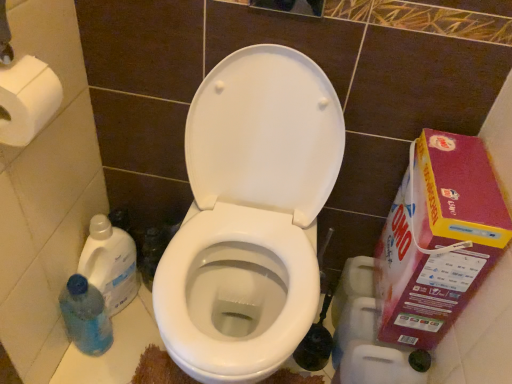
The image size is (512, 384). Find the location of `white matte toilet paper at upper left`. white matte toilet paper at upper left is located at coordinates (27, 100).

Where is `blue translucent bottle at lower left, which ranks as the second cleaning product in bottom-to-top order`? The image size is (512, 384). blue translucent bottle at lower left, which ranks as the second cleaning product in bottom-to-top order is located at coordinates (110, 263).

Who is shorter, blue translucent bottle at lower left, which ranks as the second cleaning product in bottom-to-top order, or white matte toilet paper at upper left?

white matte toilet paper at upper left is shorter.

From the image's perspective, would you say blue translucent bottle at lower left, which ranks as the second cleaning product in bottom-to-top order, is shown under white matte toilet paper at upper left?

Yes.

From a real-world perspective, which is physically below, blue translucent bottle at lower left, which ranks as the second cleaning product in bottom-to-top order, or white matte toilet paper at upper left?

blue translucent bottle at lower left, which ranks as the second cleaning product in bottom-to-top order, from a real-world perspective.

Looking at this image, which object is positioned more to the left, blue translucent bottle at lower left, positioned as the 1th cleaning product in top-to-bottom order, or white matte toilet paper at upper left?

blue translucent bottle at lower left, positioned as the 1th cleaning product in top-to-bottom order, is more to the left.

Does point (54, 73) lie in front of point (306, 147)?

Yes, it is.

Is white matte toilet paper at upper left next to white glossy toilet at center and touching it?

white matte toilet paper at upper left is not next to white glossy toilet at center, and they're not touching.

Consider the image. Is white matte toilet paper at upper left spatially inside white glossy toilet at center, or outside of it?

white matte toilet paper at upper left is outside white glossy toilet at center.

Considering the relative positions of white matte toilet paper at upper left and white glossy toilet at center in the image provided, is white matte toilet paper at upper left to the left or to the right of white glossy toilet at center?

white matte toilet paper at upper left is positioned on white glossy toilet at center's left side.

Based on the photo, considering the sizes of blue translucent bottle at lower left, which is the 1th cleaning product in bottom-to-top order, and white matte toilet paper at upper left in the image, is blue translucent bottle at lower left, which is the 1th cleaning product in bottom-to-top order, wider or thinner than white matte toilet paper at upper left?

Considering their sizes, blue translucent bottle at lower left, which is the 1th cleaning product in bottom-to-top order, looks slimmer than white matte toilet paper at upper left.

From a real-world perspective, is blue translucent bottle at lower left, which is the 1th cleaning product in bottom-to-top order, on top of white matte toilet paper at upper left?

No, from a real-world perspective, blue translucent bottle at lower left, which is the 1th cleaning product in bottom-to-top order, is not over white matte toilet paper at upper left

Locate an element on the screen. This screenshot has width=512, height=384. toilet paper above the blue translucent bottle at lower left, which ranks as the 2th cleaning product in top-to-bottom order (from a real-world perspective) is located at coordinates (27, 100).

Considering the positions of objects blue translucent bottle at lower left, which is the 1th cleaning product in bottom-to-top order, and white matte toilet paper at upper left in the image provided, who is more to the right, blue translucent bottle at lower left, which is the 1th cleaning product in bottom-to-top order, or white matte toilet paper at upper left?

Positioned to the right is white matte toilet paper at upper left.

Does blue translucent bottle at lower left, positioned as the 1th cleaning product in top-to-bottom order, have a greater width compared to pink cardboard box at right?

No, blue translucent bottle at lower left, positioned as the 1th cleaning product in top-to-bottom order, is not wider than pink cardboard box at right.

In the scene shown: Is blue translucent bottle at lower left, positioned as the 1th cleaning product in top-to-bottom order, completely or partially outside of pink cardboard box at right?

Indeed, blue translucent bottle at lower left, positioned as the 1th cleaning product in top-to-bottom order, is completely outside pink cardboard box at right.

Considering the sizes of objects blue translucent bottle at lower left, which ranks as the second cleaning product in bottom-to-top order, and pink cardboard box at right in the image provided, who is taller, blue translucent bottle at lower left, which ranks as the second cleaning product in bottom-to-top order, or pink cardboard box at right?

pink cardboard box at right.

Which is correct: blue translucent bottle at lower left, which ranks as the 2th cleaning product in top-to-bottom order, is inside blue translucent bottle at lower left, positioned as the 1th cleaning product in top-to-bottom order, or outside of it?

blue translucent bottle at lower left, which ranks as the 2th cleaning product in top-to-bottom order, is not enclosed by blue translucent bottle at lower left, positioned as the 1th cleaning product in top-to-bottom order.

Could you tell me if blue translucent bottle at lower left, which ranks as the 2th cleaning product in top-to-bottom order, is turned towards blue translucent bottle at lower left, positioned as the 1th cleaning product in top-to-bottom order?

Yes, blue translucent bottle at lower left, which ranks as the 2th cleaning product in top-to-bottom order, faces towards blue translucent bottle at lower left, positioned as the 1th cleaning product in top-to-bottom order.

From the image's perspective, is blue translucent bottle at lower left, which ranks as the 2th cleaning product in top-to-bottom order, located above blue translucent bottle at lower left, which ranks as the second cleaning product in bottom-to-top order?

No, from the image's perspective, blue translucent bottle at lower left, which ranks as the 2th cleaning product in top-to-bottom order, is not on top of blue translucent bottle at lower left, which ranks as the second cleaning product in bottom-to-top order.

Does blue translucent bottle at lower left, which ranks as the 2th cleaning product in top-to-bottom order, appear on the left side of blue translucent bottle at lower left, positioned as the 1th cleaning product in top-to-bottom order?

Correct, you'll find blue translucent bottle at lower left, which ranks as the 2th cleaning product in top-to-bottom order, to the left of blue translucent bottle at lower left, positioned as the 1th cleaning product in top-to-bottom order.

Considering the sizes of objects blue translucent bottle at lower left, positioned as the 1th cleaning product in top-to-bottom order, and white glossy toilet at center in the image provided, who is thinner, blue translucent bottle at lower left, positioned as the 1th cleaning product in top-to-bottom order, or white glossy toilet at center?

With smaller width is blue translucent bottle at lower left, positioned as the 1th cleaning product in top-to-bottom order.

This screenshot has height=384, width=512. I want to click on toilet that appears above the blue translucent bottle at lower left, which ranks as the second cleaning product in bottom-to-top order (from a real-world perspective), so click(251, 209).

Between point (122, 305) and point (211, 280), which one is positioned behind?

The point (122, 305) is farther.

Which is in front, blue translucent bottle at lower left, which ranks as the second cleaning product in bottom-to-top order, or white glossy toilet at center?

white glossy toilet at center is in front.

Is pink cardboard box at right located within white matte toilet paper at upper left?

No, pink cardboard box at right is not a part of white matte toilet paper at upper left.

Consider the image. How different are the orientations of white matte toilet paper at upper left and pink cardboard box at right in degrees?

The facing directions of white matte toilet paper at upper left and pink cardboard box at right are 178 degrees apart.

From the image's perspective, is white matte toilet paper at upper left beneath pink cardboard box at right?

No.

Is white matte toilet paper at upper left at the right side of pink cardboard box at right?

Incorrect, white matte toilet paper at upper left is not on the right side of pink cardboard box at right.

Identify the location of toilet paper lying on the right of blue translucent bottle at lower left, positioned as the 1th cleaning product in top-to-bottom order. The height and width of the screenshot is (384, 512). (27, 100).

What are the coordinates of `toilet paper above the white glossy toilet at center (from the image's perspective)` in the screenshot? It's located at (27, 100).

Which object lies nearer to the anchor point blue translucent bottle at lower left, which ranks as the second cleaning product in bottom-to-top order, white glossy toilet at center or pink cardboard box at right?

white glossy toilet at center.

Based on their spatial positions, is white glossy toilet at center or pink cardboard box at right further from blue translucent bottle at lower left, which is the 1th cleaning product in bottom-to-top order?

The object further to blue translucent bottle at lower left, which is the 1th cleaning product in bottom-to-top order, is pink cardboard box at right.

Considering their positions, is white matte toilet paper at upper left positioned further to pink cardboard box at right than blue translucent bottle at lower left, which ranks as the 2th cleaning product in top-to-bottom order?

blue translucent bottle at lower left, which ranks as the 2th cleaning product in top-to-bottom order, lies further to pink cardboard box at right than the other object.

Considering their positions, is white glossy toilet at center positioned closer to blue translucent bottle at lower left, positioned as the 1th cleaning product in top-to-bottom order, than white matte toilet paper at upper left?

white glossy toilet at center is closer to blue translucent bottle at lower left, positioned as the 1th cleaning product in top-to-bottom order.

Which object lies further to the anchor point white matte toilet paper at upper left, blue translucent bottle at lower left, positioned as the 1th cleaning product in top-to-bottom order, or white glossy toilet at center?

Among the two, blue translucent bottle at lower left, positioned as the 1th cleaning product in top-to-bottom order, is located further to white matte toilet paper at upper left.

Estimate the real-world distances between objects in this image. Which object is closer to blue translucent bottle at lower left, which ranks as the 2th cleaning product in top-to-bottom order, white matte toilet paper at upper left or white glossy toilet at center?

white glossy toilet at center is closer to blue translucent bottle at lower left, which ranks as the 2th cleaning product in top-to-bottom order.

Looking at the image, which one is located further to blue translucent bottle at lower left, which ranks as the second cleaning product in bottom-to-top order, white matte toilet paper at upper left or blue translucent bottle at lower left, which ranks as the 2th cleaning product in top-to-bottom order?

white matte toilet paper at upper left.

Looking at the image, which one is located closer to white matte toilet paper at upper left, pink cardboard box at right or white glossy toilet at center?

white glossy toilet at center lies closer to white matte toilet paper at upper left than the other object.

Find the location of `cleaning product between white matte toilet paper at upper left and blue translucent bottle at lower left, positioned as the 1th cleaning product in top-to-bottom order, in the front-back direction`. cleaning product between white matte toilet paper at upper left and blue translucent bottle at lower left, positioned as the 1th cleaning product in top-to-bottom order, in the front-back direction is located at coordinates (86, 316).

At what (x,y) coordinates should I click in order to perform the action: click on toilet paper between blue translucent bottle at lower left, positioned as the 1th cleaning product in top-to-bottom order, and pink cardboard box at right. Please return your answer as a coordinate pair (x, y). Looking at the image, I should click on (27, 100).

The height and width of the screenshot is (384, 512). Identify the location of toilet paper situated between blue translucent bottle at lower left, which is the 1th cleaning product in bottom-to-top order, and pink cardboard box at right from left to right. (27, 100).

Image resolution: width=512 pixels, height=384 pixels. In order to click on cleaning product positioned between white glossy toilet at center and blue translucent bottle at lower left, positioned as the 1th cleaning product in top-to-bottom order, from near to far in this screenshot , I will do `click(86, 316)`.